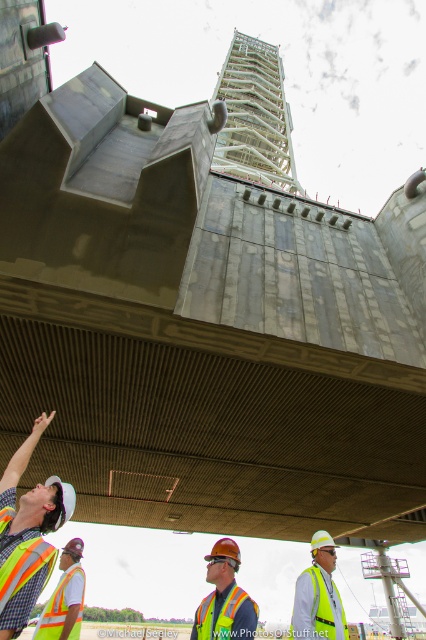
Question: Is reflective fabric safety vest at lower left bigger than reflective fabric safety vest at lower center?

Choices:
 (A) yes
 (B) no

Answer: (B)

Question: Which of the following is the farthest from the observer?

Choices:
 (A) reflective fabric safety vest at lower center
 (B) reflective yellow safety vest at lower left
 (C) reflective fabric safety vest at lower left

Answer: (B)

Question: Is white metallic tower at upper center smaller than reflective yellow safety vest at lower left?

Choices:
 (A) yes
 (B) no

Answer: (B)

Question: Which object is the closest to the reflective yellow safety vest at center?

Choices:
 (A) reflective fabric safety vest at lower center
 (B) reflective yellow safety vest at lower left

Answer: (A)

Question: Can you confirm if reflective yellow safety vest at center is positioned above reflective yellow safety vest at lower left?

Choices:
 (A) yes
 (B) no

Answer: (A)

Question: Among these points, which one is nearest to the camera?

Choices:
 (A) (49, 636)
 (B) (13, 550)

Answer: (B)